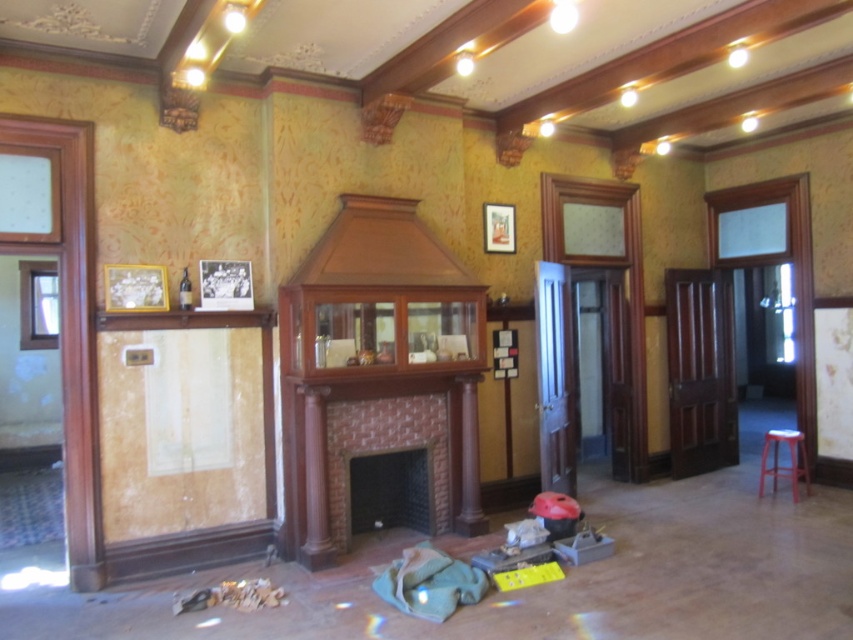
Which is behind, point (210, 300) or point (793, 481)?

The point (793, 481) is behind.

Which is above, black matte photo frame at upper left or matte plastic stool at right?

black matte photo frame at upper left is above.

Is point (236, 285) behind point (767, 452)?

No, it is not.

The width and height of the screenshot is (853, 640). I want to click on black matte photo frame at upper left, so click(x=225, y=284).

Is brick fireplace at center to the left of matte plastic stool at right from the viewer's perspective?

Correct, you'll find brick fireplace at center to the left of matte plastic stool at right.

Does point (399, 426) come farther from viewer compared to point (808, 484)?

That is False.

The image size is (853, 640). Identify the location of brick fireplace at center. (387, 452).

Is brick fireplace at center bigger than brown polished wood pillar at center?

Yes, brick fireplace at center is bigger than brown polished wood pillar at center.

Is brick fireplace at center to the left of brown polished wood pillar at center from the viewer's perspective?

Correct, you'll find brick fireplace at center to the left of brown polished wood pillar at center.

Find the location of a particular element. The width and height of the screenshot is (853, 640). brick fireplace at center is located at coordinates (387, 452).